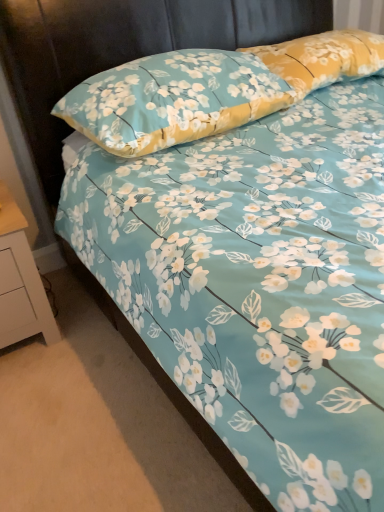
Locate an element on the screen. vacant point to the right of white painted wood nightstand at lower left is located at coordinates (83, 326).